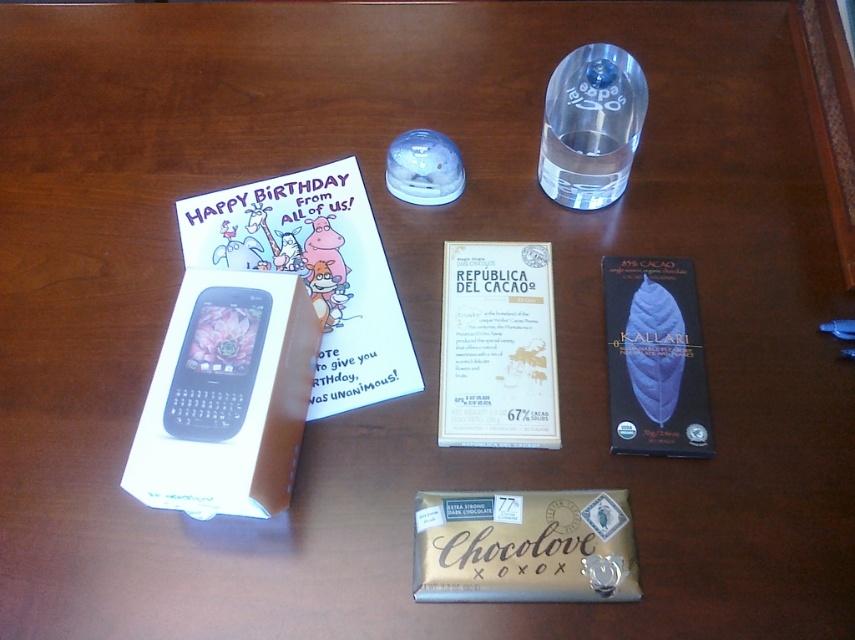
Question: Does gold foil chocolate bar at center appear on the left side of transparent glass bottle at upper center?

Choices:
 (A) yes
 (B) no

Answer: (A)

Question: Which of the following is the farthest from the observer?

Choices:
 (A) gold foil chocolate bar at center
 (B) dark chocolate bar at center right

Answer: (B)

Question: Which object is positioned closest to the dark chocolate bar at center right?

Choices:
 (A) gold foil chocolate bar at center
 (B) transparent glass bottle at upper center

Answer: (A)

Question: Among these points, which one is farthest from the camera?

Choices:
 (A) (575, 60)
 (B) (680, 260)

Answer: (A)

Question: Does dark chocolate bar at center right have a larger size compared to transparent glass bottle at upper center?

Choices:
 (A) no
 (B) yes

Answer: (A)

Question: Is gold foil chocolate bar at center above transparent glass bottle at upper center?

Choices:
 (A) no
 (B) yes

Answer: (A)